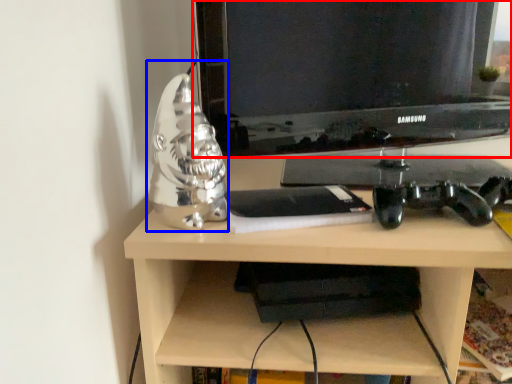
Question: Which object is further to the camera taking this photo, television (highlighted by a red box) or figurine (highlighted by a blue box)?

Choices:
 (A) television
 (B) figurine

Answer: (A)